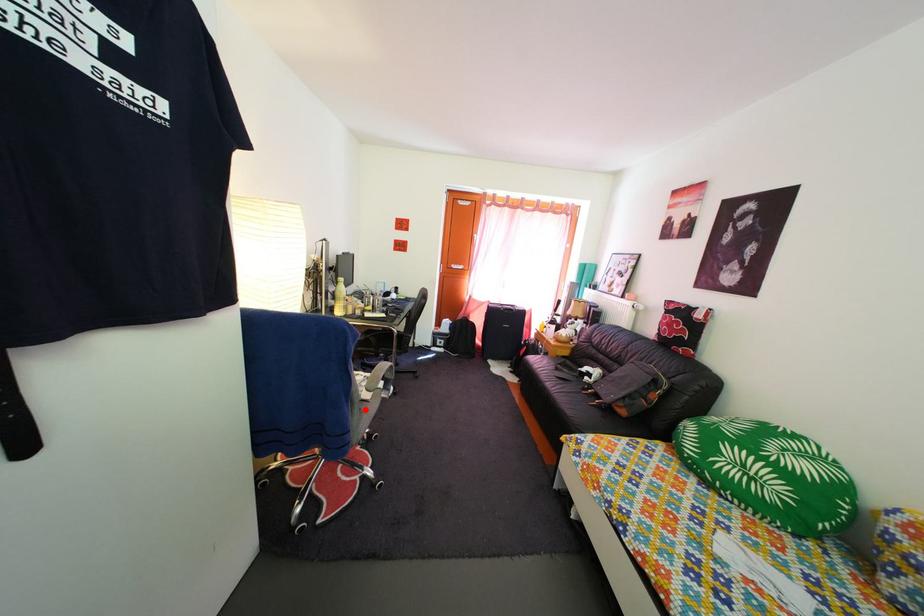
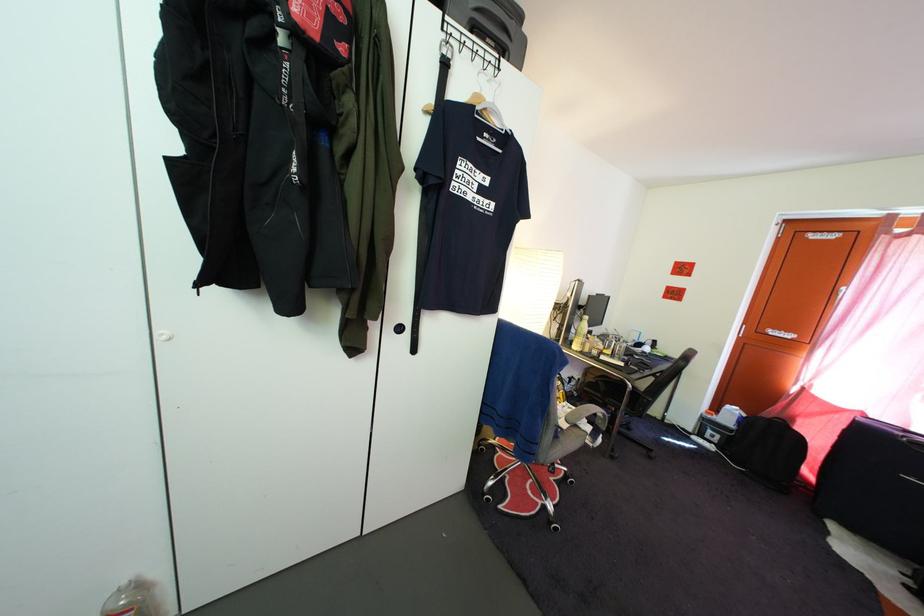
Question: I am providing you with two images of the same scene from different viewpoints. In image1, a red point is highlighted. Considering the same 3D point in image2, which of the following is correct?

Choices:
 (A) It is closer
 (B) It is farther

Answer: (B)